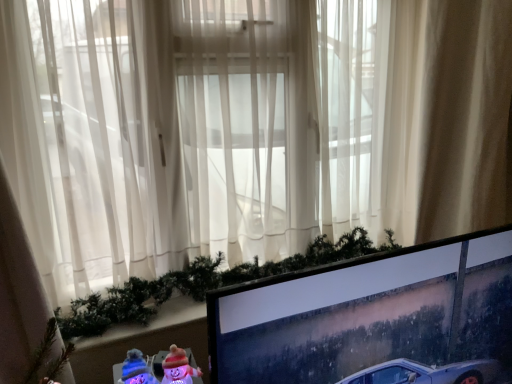
This screenshot has height=384, width=512. What do you see at coordinates (445, 118) in the screenshot?
I see `beige fabric curtain at right` at bounding box center [445, 118].

Image resolution: width=512 pixels, height=384 pixels. What are the coordinates of `beige fabric curtain at right` in the screenshot? It's located at 445,118.

Measure the distance between point (289, 375) and camera.

The distance of point (289, 375) from camera is 3.30 feet.

Find the location of a particular element. matte black monitor at lower right is located at coordinates (372, 318).

What do you see at coordinates (372, 318) in the screenshot?
I see `matte black monitor at lower right` at bounding box center [372, 318].

This screenshot has width=512, height=384. Identify the location of beige fabric curtain at right. (445, 118).

Can you confirm if beige fabric curtain at right is positioned to the right of matte black monitor at lower right?

Indeed, beige fabric curtain at right is positioned on the right side of matte black monitor at lower right.

In the image, is beige fabric curtain at right positioned in front of or behind matte black monitor at lower right?

beige fabric curtain at right is positioned farther from the viewer than matte black monitor at lower right.

Is point (398, 195) positioned after point (486, 381)?

Yes, it is.

From the image's perspective, is beige fabric curtain at right above or below matte black monitor at lower right?

From the image's perspective, beige fabric curtain at right appears above matte black monitor at lower right.

From a real-world perspective, who is located lower, beige fabric curtain at right or matte black monitor at lower right?

matte black monitor at lower right is physically lower.

Between beige fabric curtain at right and matte black monitor at lower right, which one has larger width?

With larger width is beige fabric curtain at right.

Can you confirm if beige fabric curtain at right is taller than matte black monitor at lower right?

Yes.

Is beige fabric curtain at right bigger or smaller than matte black monitor at lower right?

In the image, beige fabric curtain at right appears to be larger than matte black monitor at lower right.

Is matte black monitor at lower right inside beige fabric curtain at right?

No.

Is beige fabric curtain at right placed right next to matte black monitor at lower right?

No.

Is beige fabric curtain at right aimed at matte black monitor at lower right?

Yes, beige fabric curtain at right is turned towards matte black monitor at lower right.

At what (x,y) coordinates should I click in order to perform the action: click on curtain that is on the right side of matte black monitor at lower right. Please return your answer as a coordinate pair (x, y). This screenshot has height=384, width=512. Looking at the image, I should click on (445, 118).

Consider the image. Is matte black monitor at lower right at the right side of beige fabric curtain at right?

No, matte black monitor at lower right is not to the right of beige fabric curtain at right.

Considering the positions of objects matte black monitor at lower right and beige fabric curtain at right in the image provided, who is behind, matte black monitor at lower right or beige fabric curtain at right?

beige fabric curtain at right is further from the camera.

Is point (450, 272) closer or farther from the camera than point (446, 68)?

Point (450, 272) is positioned closer to the camera compared to point (446, 68).

From the image's perspective, is matte black monitor at lower right located above or below beige fabric curtain at right?

From the image's perspective, matte black monitor at lower right appears below beige fabric curtain at right.

From a real-world perspective, who is located lower, matte black monitor at lower right or beige fabric curtain at right?

matte black monitor at lower right.

Looking at this image, between matte black monitor at lower right and beige fabric curtain at right, which one has larger width?

beige fabric curtain at right.

Considering the sizes of objects matte black monitor at lower right and beige fabric curtain at right in the image provided, who is taller, matte black monitor at lower right or beige fabric curtain at right?

beige fabric curtain at right is taller.

In terms of size, does matte black monitor at lower right appear bigger or smaller than beige fabric curtain at right?

Considering their sizes, matte black monitor at lower right takes up less space than beige fabric curtain at right.

Consider the image. Is matte black monitor at lower right situated inside beige fabric curtain at right or outside?

matte black monitor at lower right is not enclosed by beige fabric curtain at right.

Are matte black monitor at lower right and beige fabric curtain at right beside each other?

No, matte black monitor at lower right is not with beige fabric curtain at right.

Consider the image. Is matte black monitor at lower right facing towards beige fabric curtain at right?

No, matte black monitor at lower right is not aimed at beige fabric curtain at right.

In order to click on computer monitor that appears on the left of beige fabric curtain at right in this screenshot , I will do `click(372, 318)`.

This screenshot has width=512, height=384. In order to click on computer monitor located below the beige fabric curtain at right (from the image's perspective) in this screenshot , I will do click(x=372, y=318).

You are a GUI agent. You are given a task and a screenshot of the screen. Output one action in this format:
    pyautogui.click(x=<x>, y=<y>)
    Task: Click on the curtain located behind the matte black monitor at lower right
    
    Given the screenshot: What is the action you would take?
    pyautogui.click(x=445, y=118)